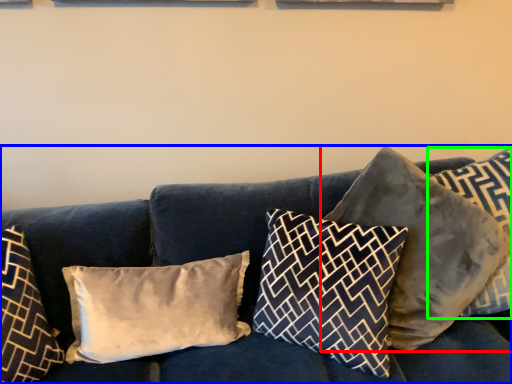
Question: Which is farther away from pillow (highlighted by a red box)? studio couch (highlighted by a blue box) or pillow (highlighted by a green box)?

Choices:
 (A) studio couch
 (B) pillow

Answer: (A)